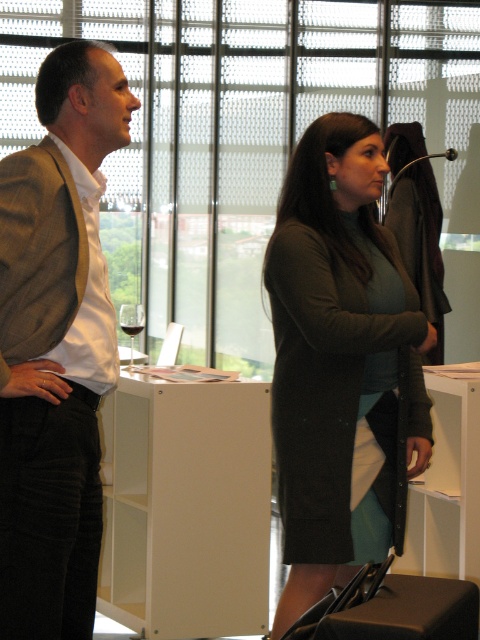
Question: Where is matte brown blazer at left located in relation to transparent glass wine glass at center in the image?

Choices:
 (A) right
 (B) left

Answer: (A)

Question: Can you confirm if dark green sweater at center is positioned below translucent glass wine at center?

Choices:
 (A) no
 (B) yes

Answer: (B)

Question: Among these objects, which one is nearest to the camera?

Choices:
 (A) matte brown blazer at left
 (B) translucent glass wine at center

Answer: (A)

Question: Which object appears closest to the camera in this image?

Choices:
 (A) dark green sweater at center
 (B) matte brown blazer at left
 (C) transparent glass wine glass at center

Answer: (B)

Question: Is dark green sweater at center positioned in front of matte brown blazer at left?

Choices:
 (A) yes
 (B) no

Answer: (B)

Question: Which point is farther from the camera taking this photo?

Choices:
 (A) (41, 108)
 (B) (298, 394)
 (C) (126, 326)

Answer: (C)